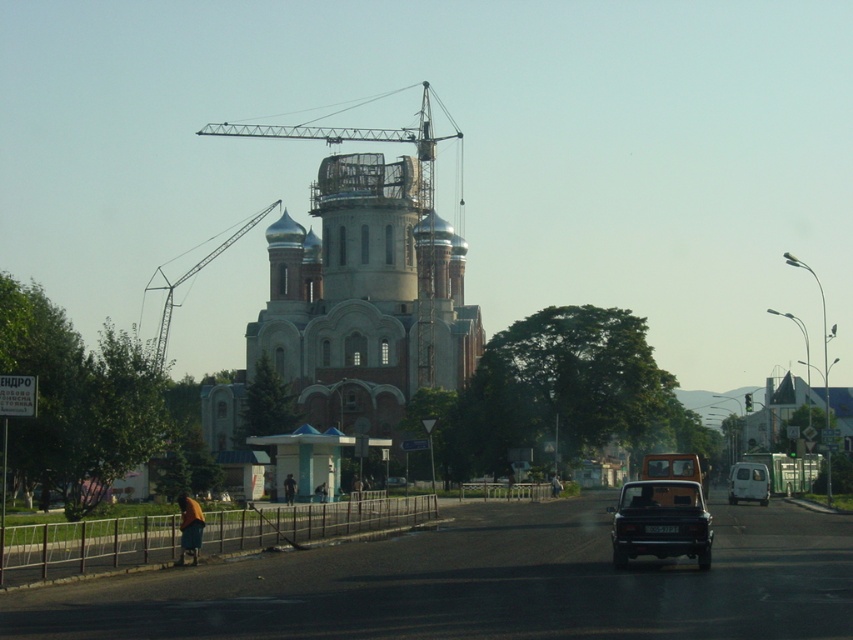
Question: Is light gray stone church at center further to camera compared to metallic construction crane at center?

Choices:
 (A) yes
 (B) no

Answer: (A)

Question: Does metallic construction crane at center have a smaller size compared to white matte van at center?

Choices:
 (A) no
 (B) yes

Answer: (A)

Question: Can you confirm if light gray stone church at center is positioned to the left of matte black car at center?

Choices:
 (A) yes
 (B) no

Answer: (A)

Question: Which of the following is the closest to the observer?

Choices:
 (A) (767, 472)
 (B) (254, 224)

Answer: (A)

Question: Among these points, which one is farthest from the camera?

Choices:
 (A) (697, 508)
 (B) (149, 280)

Answer: (B)

Question: Considering the real-world distances, which object is closest to the metallic construction crane at center?

Choices:
 (A) light gray stone church at center
 (B) shiny black sedan at center
 (C) brown matte car at center
 (D) matte black car at center

Answer: (A)